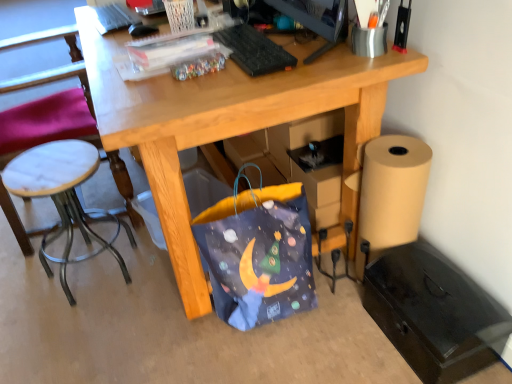
Find the location of a particular element. The image size is (512, 384). vacant space to the right of white marble stool at left is located at coordinates (155, 281).